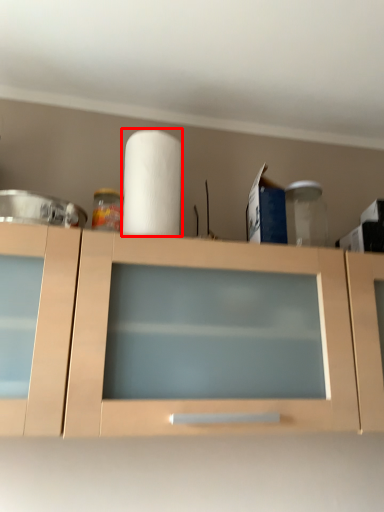
Question: From the image's perspective, where is paper towel (annotated by the red box) located relative to cabinetry?

Choices:
 (A) below
 (B) above

Answer: (B)